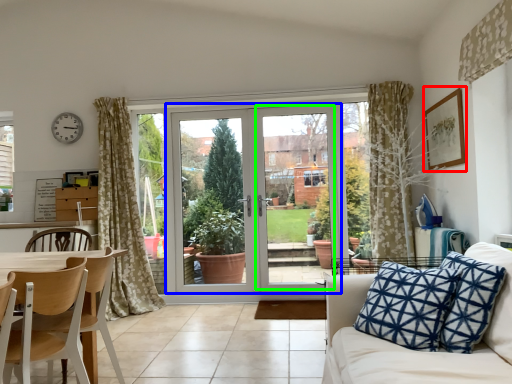
Question: Which object is the farthest from picture frame (highlighted by a red box)? Choose among these: door (highlighted by a blue box) or screen door (highlighted by a green box).

Choices:
 (A) door
 (B) screen door

Answer: (A)